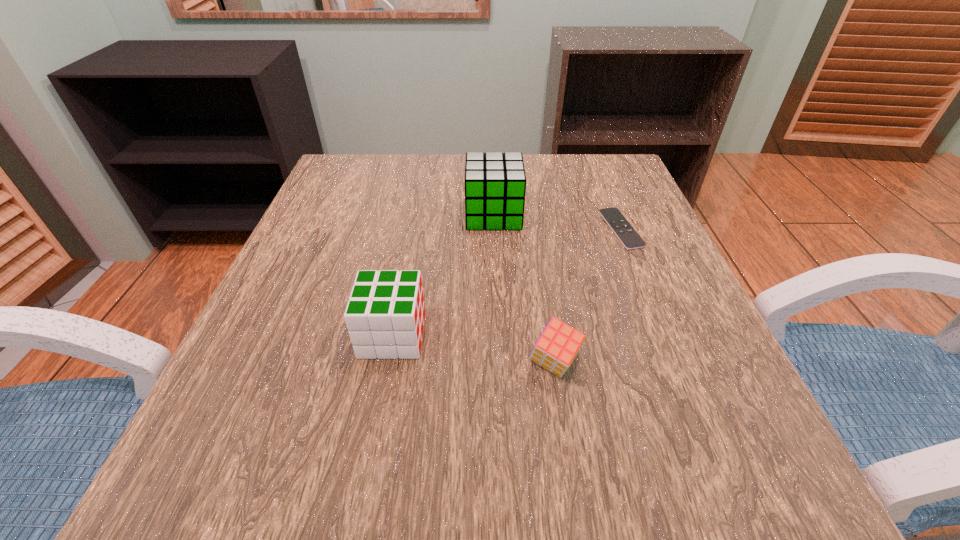
Where is `vacant area situated 0.160m on the front of the remote control`? The image size is (960, 540). vacant area situated 0.160m on the front of the remote control is located at coordinates (653, 309).

Image resolution: width=960 pixels, height=540 pixels. I want to click on object located in the far edge section of the desktop, so click(x=495, y=183).

Identify the location of object located at the right edge. The width and height of the screenshot is (960, 540). (627, 235).

In the image, there is a desktop. Identify the location of blank space at the far edge. (451, 170).

Locate an element on the screen. This screenshot has height=540, width=960. vacant space at the near edge of the desktop is located at coordinates (499, 455).

In the image, there is a desktop. Where is `free space at the left edge`? free space at the left edge is located at coordinates (371, 237).

This screenshot has height=540, width=960. In order to click on free region at the right edge in this screenshot , I will do `click(608, 306)`.

This screenshot has width=960, height=540. What are the coordinates of `free space at the far left corner of the desktop` in the screenshot? It's located at (343, 199).

I want to click on vacant space at the far right corner of the desktop, so click(x=610, y=163).

Find the location of a particular element. Image resolution: width=960 pixels, height=540 pixels. vacant space that's between the rightmost object and the second shortest object is located at coordinates (588, 296).